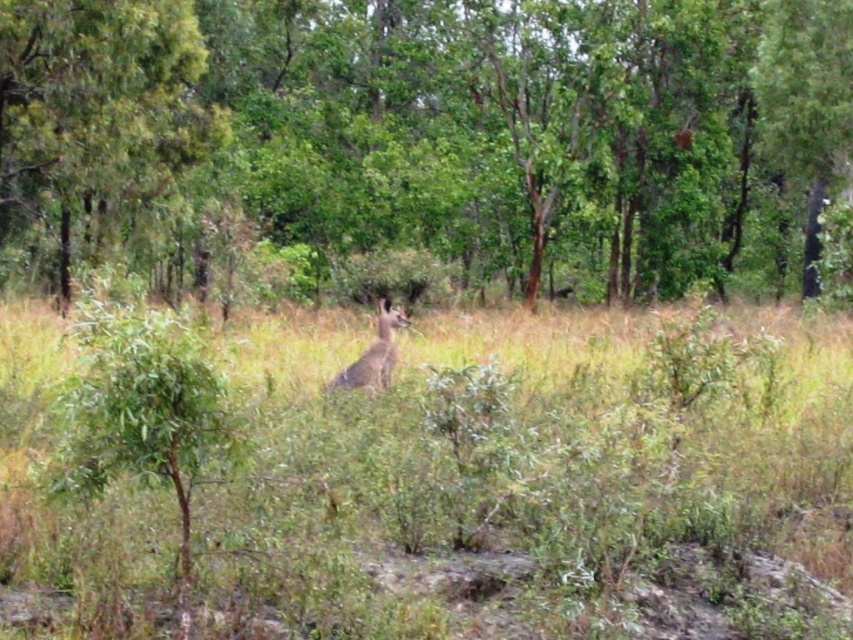
Question: Which object appears farthest from the camera in this image?

Choices:
 (A) brown textured tree at center
 (B) green grassy at center
 (C) brown fur kangaroo at center
 (D) green leafy tree at upper left

Answer: (D)

Question: Is brown textured tree at center bigger than green grassy at center?

Choices:
 (A) no
 (B) yes

Answer: (B)

Question: Can you confirm if brown textured tree at center is smaller than brown fur kangaroo at center?

Choices:
 (A) yes
 (B) no

Answer: (B)

Question: Does brown textured tree at center have a greater width compared to green grassy at center?

Choices:
 (A) yes
 (B) no

Answer: (A)

Question: Considering the real-world distances, which object is closest to the green grassy at center?

Choices:
 (A) brown textured tree at center
 (B) green leafy tree at upper left
 (C) brown fur kangaroo at center

Answer: (C)

Question: Which object is positioned closest to the brown textured tree at center?

Choices:
 (A) green leafy tree at upper left
 (B) brown fur kangaroo at center
 (C) green grassy at center

Answer: (A)